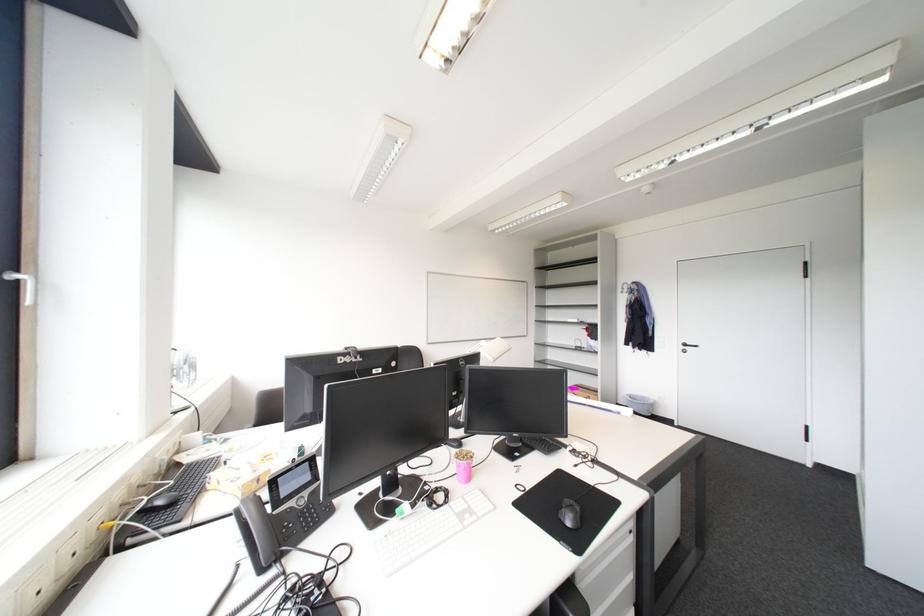
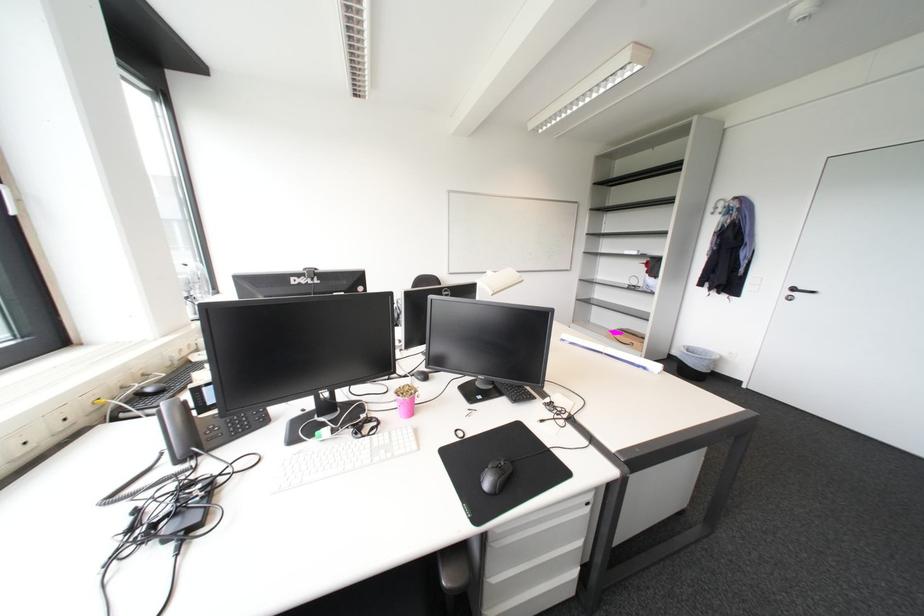
Where in the second image is the point corresponding to point 476,458 from the first image?

(415, 394)